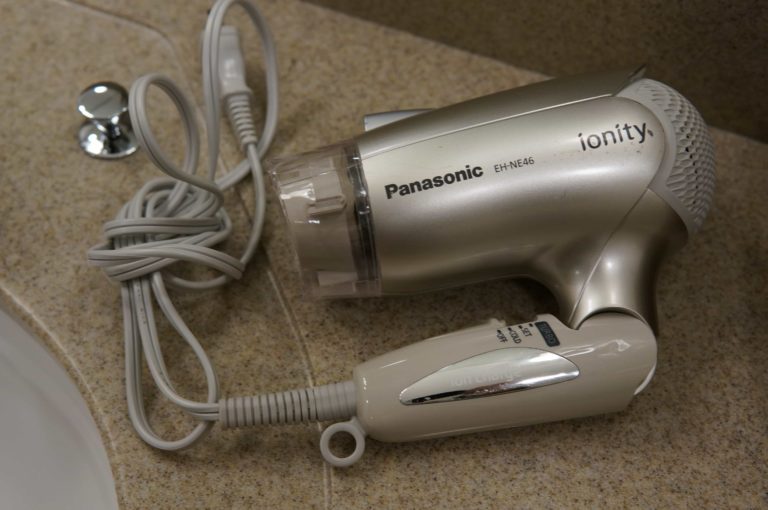
Locate an element on the screen. Image resolution: width=768 pixels, height=510 pixels. counter top is located at coordinates (505, 476).